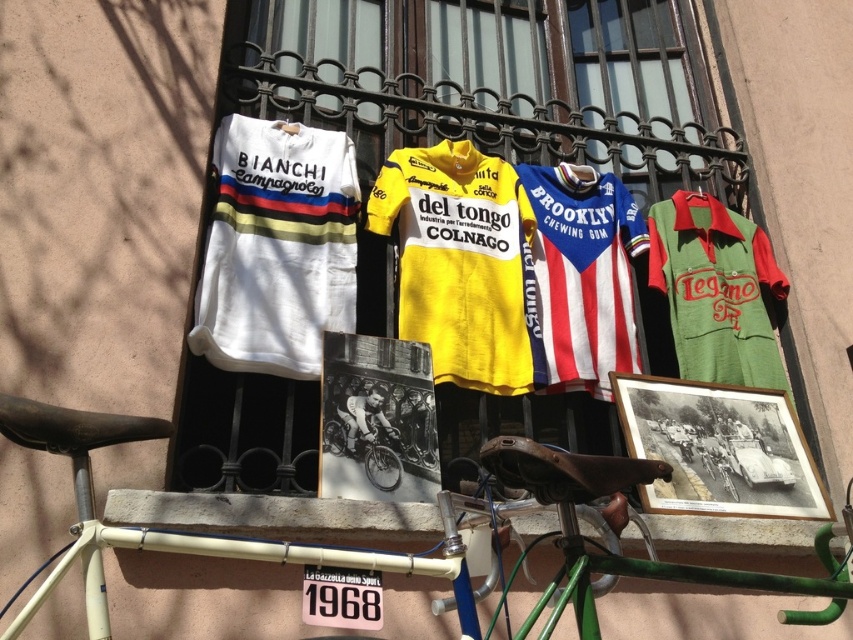
Question: Does white jersey at upper left appear on the right side of white matte bicycle at lower left?

Choices:
 (A) no
 (B) yes

Answer: (B)

Question: Is white matte bicycle at lower left positioned behind shiny silver bicycle at center?

Choices:
 (A) yes
 (B) no

Answer: (B)

Question: Is white matte bicycle at lower left smaller than yellow jersey at center?

Choices:
 (A) no
 (B) yes

Answer: (A)

Question: Which of the following is the closest to the observer?

Choices:
 (A) (439, 154)
 (B) (229, 124)

Answer: (B)

Question: Based on their relative distances, which object is farther from the green jersey at right?

Choices:
 (A) white matte bicycle at lower left
 (B) yellow jersey at center
 (C) white jersey at upper left

Answer: (A)

Question: Which point is closer to the camera?

Choices:
 (A) yellow jersey at center
 (B) white jersey at upper left
 (C) green jersey at right

Answer: (A)